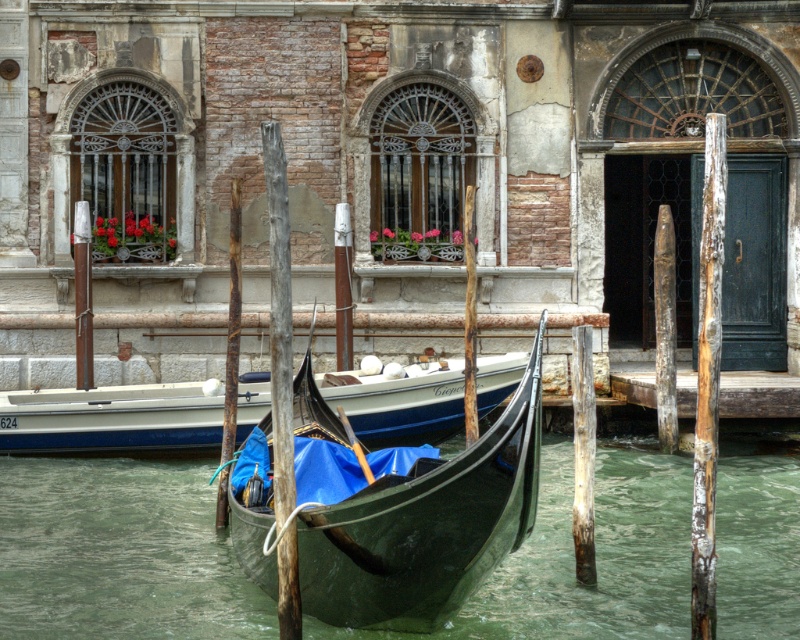
You are standing on the wooden dock and want to reach the green water at gondola center. Can you step directly into the water without needing to move forward or backward?

The green water at gondola center is 13.61 meters away from the viewer, so stepping directly into the water without moving forward or backward is not possible as the distance is too great.